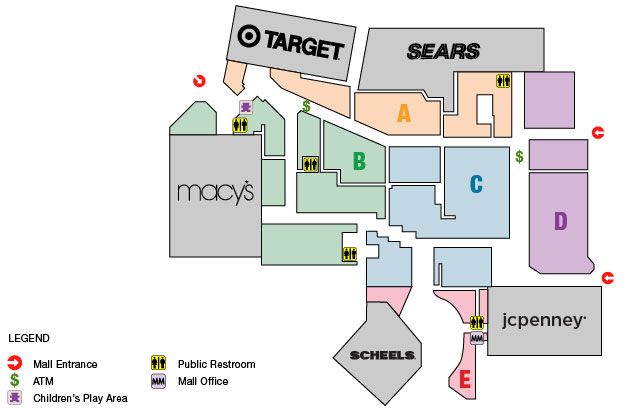
Where is `bathrooms`? The height and width of the screenshot is (410, 640). bathrooms is located at coordinates (240, 125), (304, 161), (351, 253), (477, 325), (504, 86).